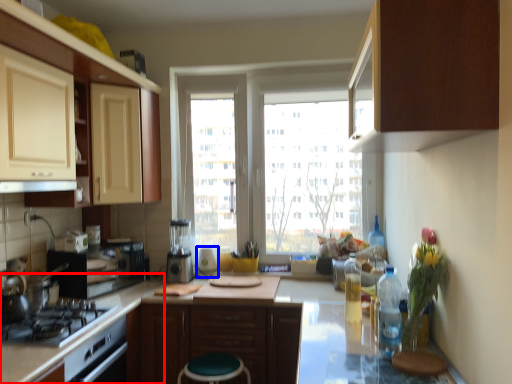
Question: Among these objects, which one is farthest to the camera, counter top (highlighted by a red box) or appliance (highlighted by a blue box)?

Choices:
 (A) counter top
 (B) appliance

Answer: (B)